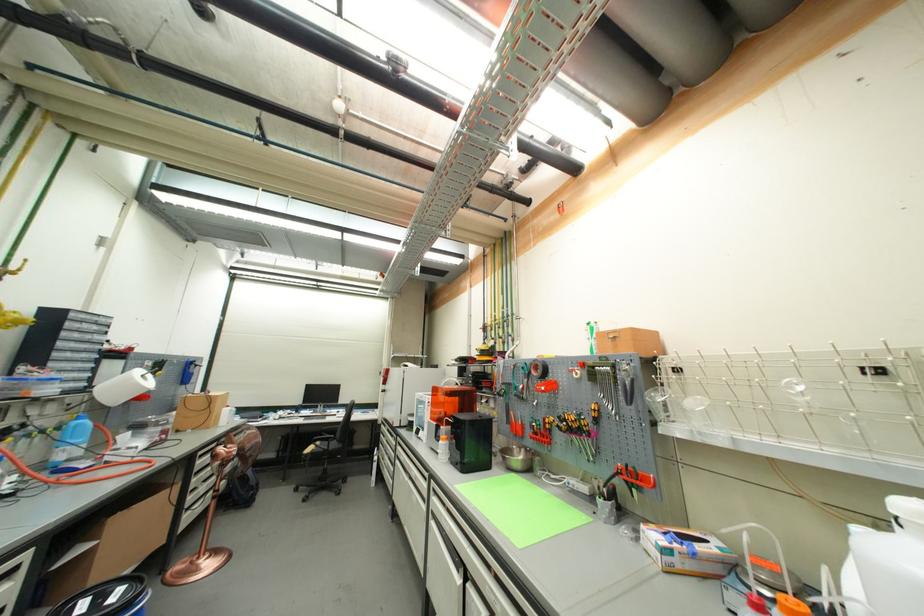
Where is `red bottle cap`? The image size is (924, 616). red bottle cap is located at coordinates (757, 602).